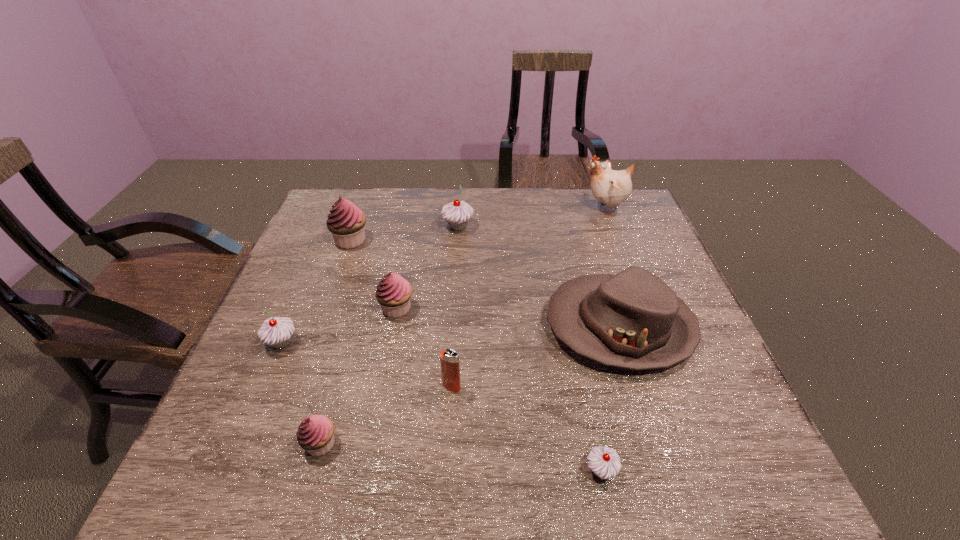
Locate an element on the screen. the third closest pink cupcake relative to the third nearest cupcake is located at coordinates (346, 222).

Identify which pink cupcake is the closest to the fourth farthest cupcake. Please provide its 2D coordinates. Your answer should be formatted as a tuple, i.e. [(x, y)], where the tuple contains the x and y coordinates of a point satisfying the conditions above.

[(393, 293)]

Image resolution: width=960 pixels, height=540 pixels. I want to click on free space that satisfies the following two spatial constraints: 1. on the decorative side of the hat; 2. on the front side of the nearest pink cupcake, so click(656, 443).